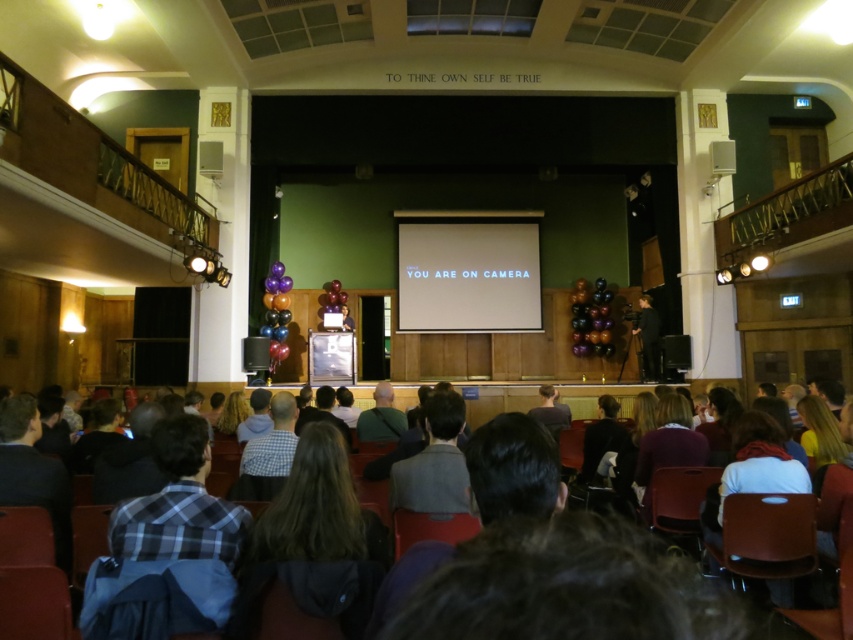
You are a stagehand preparing to adjust the lighting for a presentation. You have to position a spotlight so it illuminates both the white glossy projection screen at center and the black matte suit at center. Considering their sizes, which object requires a wider beam spread to cover its entire surface?

The white glossy projection screen at center might be wider than black matte suit at center, so the spotlight needs a wider beam spread for the white glossy projection screen at center to ensure full coverage.

You are an event organizer preparing to adjust the stage setup. You need to place a new podium between the white glossy projection screen at center and the black matte suit at center. Based on their current positions, which side of the podium should face the audience for optimal visibility?

The white glossy projection screen at center is positioned on the left side of the black matte suit at center. To ensure optimal visibility, the podium should be placed between them with its front side facing the audience, positioned between the white glossy projection screen at center and the black matte suit at center.

You are organizing an event in the lecture hall and need to place a green fabric bag at center near the white glossy projection screen at center. Considering their sizes, which object is wider?

The white glossy projection screen at center is wider than the green fabric bag at center according to the description provided.